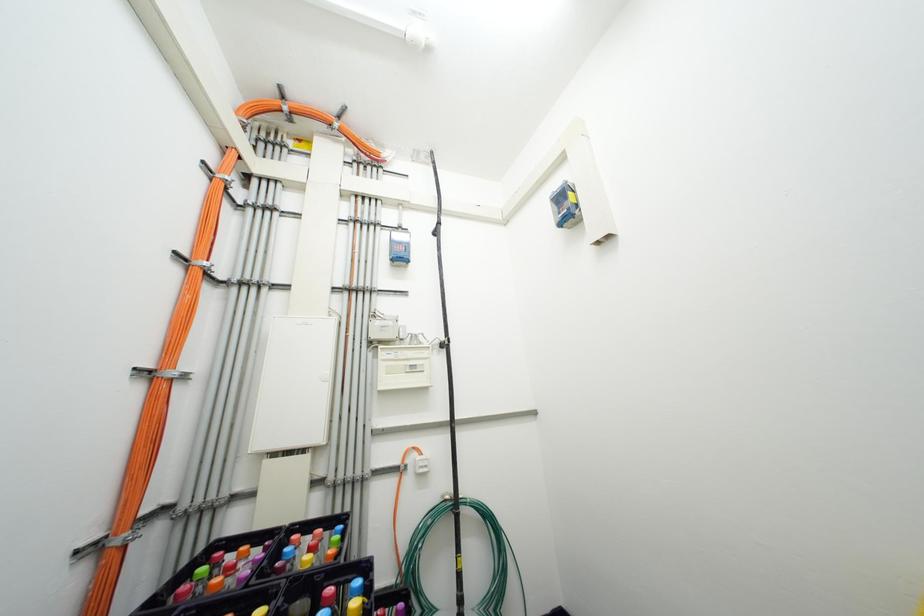
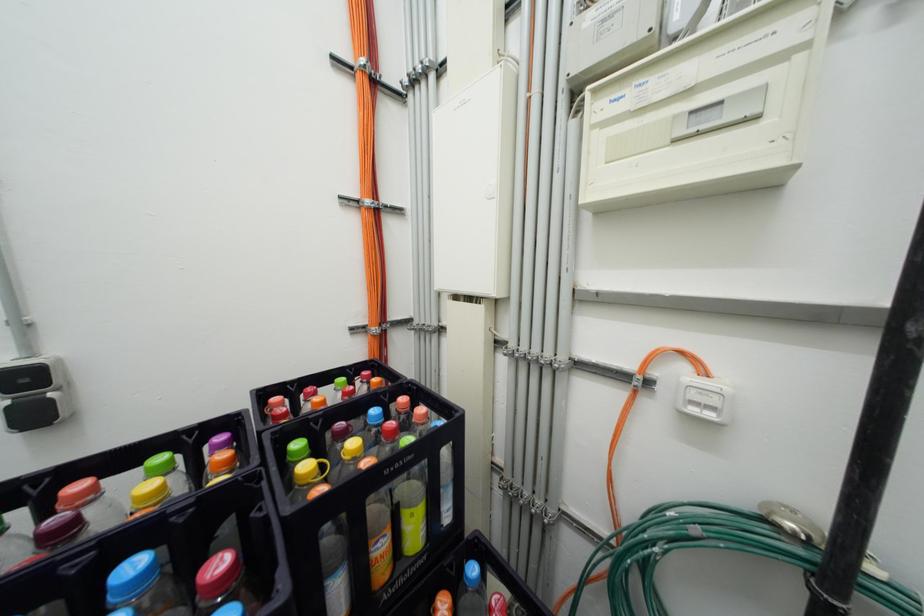
Based on the continuous images, in which direction is the camera rotating?

The camera rotated toward left-down.